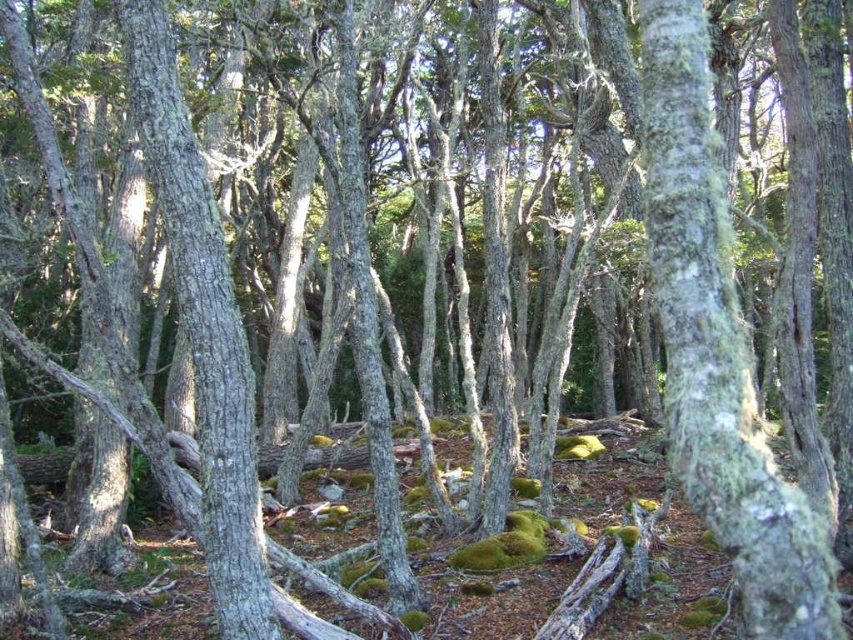
Based on the photo, does green mossy bark tree trunk at center lie behind smooth gray bark at center?

Answer: No, green mossy bark tree trunk at center is in front of smooth gray bark at center.

Which is in front, point (822, 548) or point (236, 632)?

Point (822, 548)

Does point (708, 417) come closer to viewer compared to point (236, 428)?

Yes, point (708, 417) is closer to viewer.

Locate an element on the screen. green mossy bark tree trunk at center is located at coordinates (718, 349).